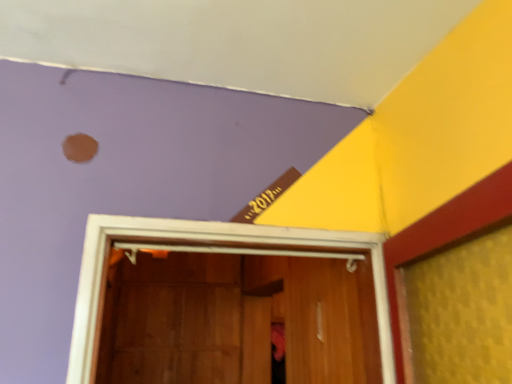
You are a GUI agent. You are given a task and a screenshot of the screen. Output one action in this format:
    pyautogui.click(x=<x>, y=<y>)
    Task: Click on the matte brown hole at upper left
    This screenshot has width=512, height=384.
    Given the screenshot: What is the action you would take?
    pyautogui.click(x=79, y=147)

What do you see at coordinates (79, 147) in the screenshot? The width and height of the screenshot is (512, 384). I see `matte brown hole at upper left` at bounding box center [79, 147].

Locate an element on the screen. The height and width of the screenshot is (384, 512). matte brown hole at upper left is located at coordinates (79, 147).